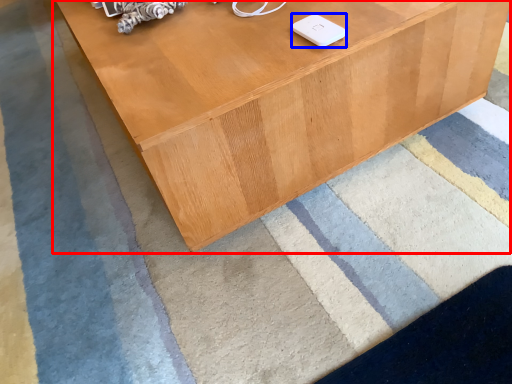
Question: Which of the following is the farthest to the observer, table (highlighted by a red box) or ipod (highlighted by a blue box)?

Choices:
 (A) table
 (B) ipod

Answer: (B)